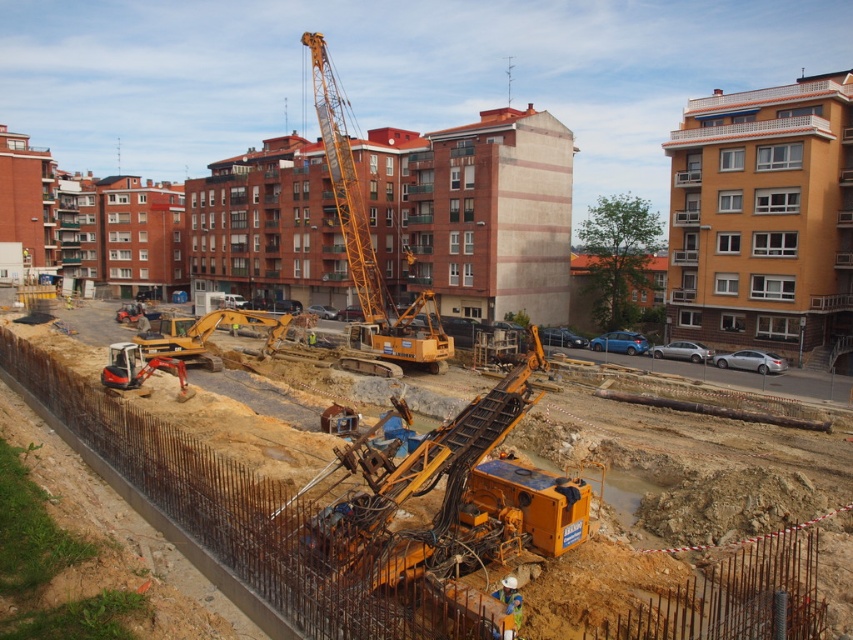
Please provide the coordinates of the yellow metallic construction equipment at center in the image. The coordinate system is normalized, with the origin at the bottom left corner of the image. The x and y axes are measured in fractions of the image width and height respectively. Please answer with two decimal places precision.

The coordinates of the yellow metallic construction equipment at center are approximately at point (605,563).

You are a construction worker standing at the point with coordinates point (619, 604). You need to move to the point with coordinates point (370, 310). Which direction should you walk to reach your destination?

To reach point (370, 310) from point (619, 604), you should walk towards the direction where point (370, 310) is located, which is behind point (619, 604) based on their spatial relationship.

You are a safety inspector at the construction site. You need to ensure that the yellow metallic construction equipment at center and the yellow metallic drilling rig at center are both within the restricted access area marked by the red and white barriers. Can you confirm if both are inside the barriers?

Both the yellow metallic construction equipment at center and the yellow metallic drilling rig at center are positioned within the restricted access area marked by the red and white barriers, as the scene describes the entire construction site as being fenced off with these barriers.